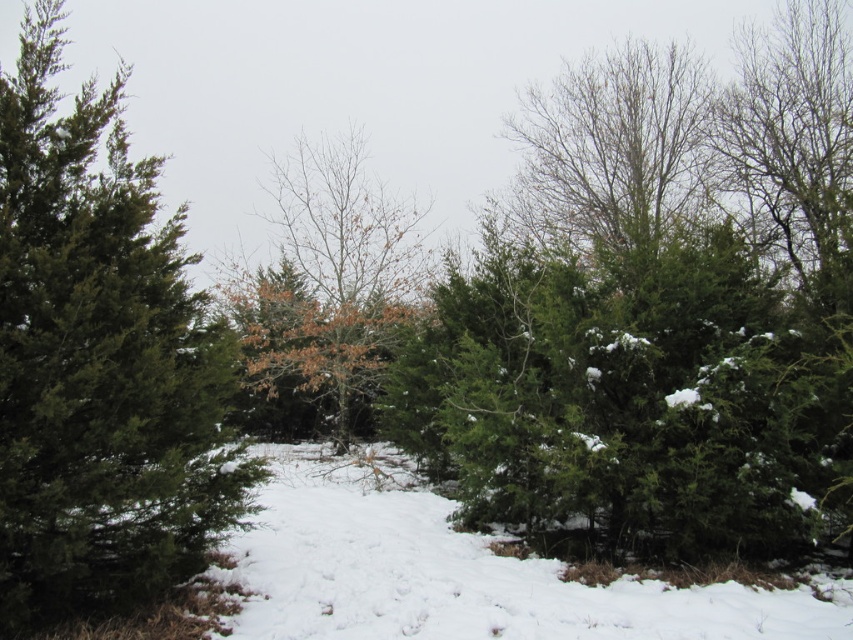
You are standing at point A and want to walk to point B. The coordinates for point A are point A at (561, 636) and point B is at 0.543, 0.321. The path between them is 4.25 meters long. If your walking speed is 1.5 meters per second, how many seconds will it take you to reach point B?

The distance between point A at (561, 636) and point B is 4.25 meters. At a walking speed of 1.5 meters per second, it will take approximately 2.83 seconds to reach point B.

You are standing in the winter scene described. You need to locate the green matte evergreen tree at left. Based on its 2D coordinates, where would you look relative to the center of the image?

The green matte evergreen tree at left is located at coordinates approximately 0.566 on the x axis and 0.117 on the y axis, which places it slightly to the right and above the center of the image.